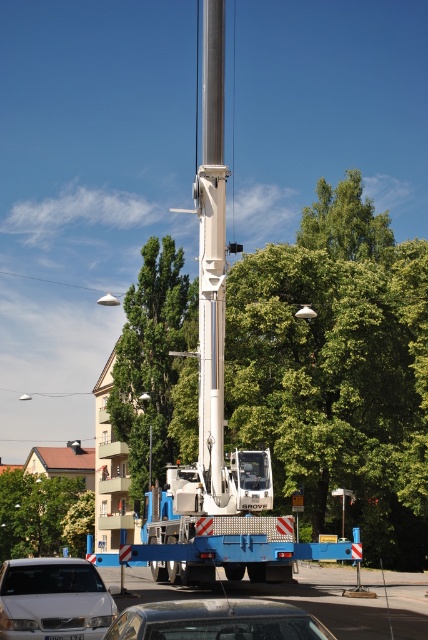
Who is taller, silver metallic pole at center or shiny silver car at lower center?

silver metallic pole at center

What do you see at coordinates (211, 250) in the screenshot?
I see `silver metallic pole at center` at bounding box center [211, 250].

Where is `silver metallic pole at center`? The image size is (428, 640). silver metallic pole at center is located at coordinates (211, 250).

Locate an element on the screen. silver metallic pole at center is located at coordinates (211, 250).

Between white matte car at lower left and shiny silver car at lower center, which one has more height?

white matte car at lower left is taller.

Is the position of white matte car at lower left more distant than that of shiny silver car at lower center?

Yes, it is behind shiny silver car at lower center.

Between point (112, 602) and point (238, 620), which one is positioned in front?

Point (238, 620)

Find the location of `white matte car at lower left`. white matte car at lower left is located at coordinates (53, 600).

Can you confirm if silver metallic pole at center is positioned below white matte car at lower left?

Actually, silver metallic pole at center is above white matte car at lower left.

Is silver metallic pole at center closer to camera compared to white matte car at lower left?

No, it is behind white matte car at lower left.

What do you see at coordinates (211, 250) in the screenshot? The image size is (428, 640). I see `silver metallic pole at center` at bounding box center [211, 250].

Locate an element on the screen. The image size is (428, 640). silver metallic pole at center is located at coordinates (211, 250).